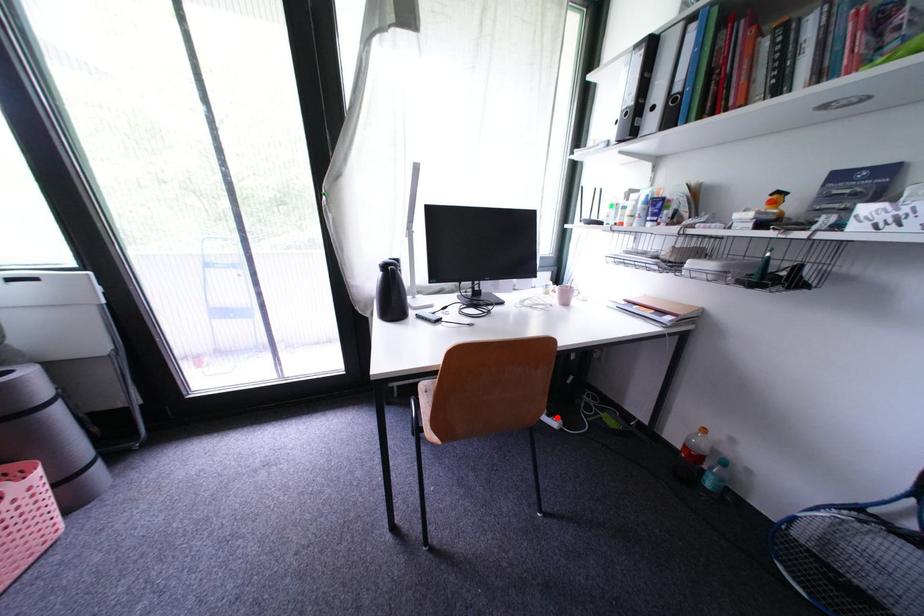
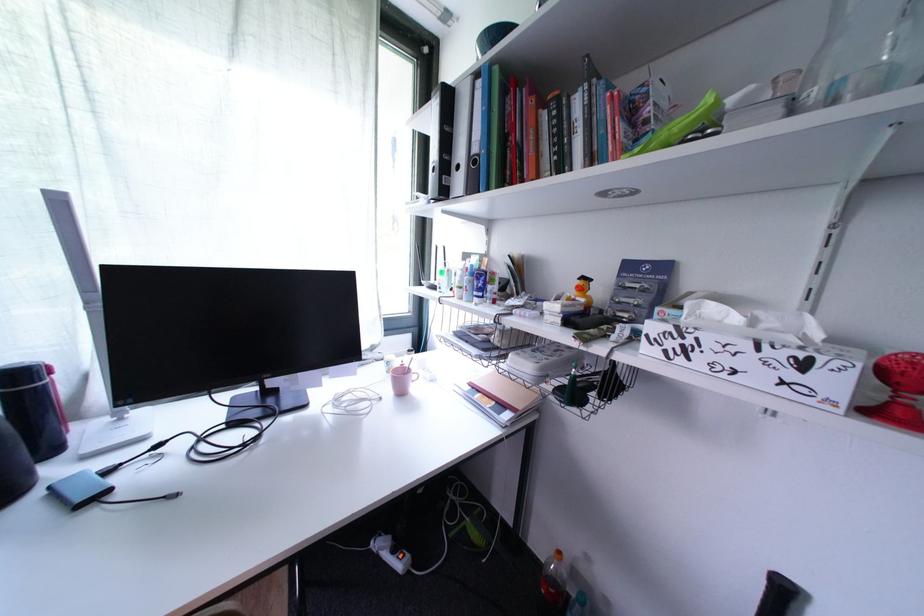
Question: I am providing you with two images of the same scene from different viewpoints. In image1, a red point is highlighted. Considering the same 3D point in image2, which of the following is correct?

Choices:
 (A) It is closer
 (B) It is farther

Answer: (A)